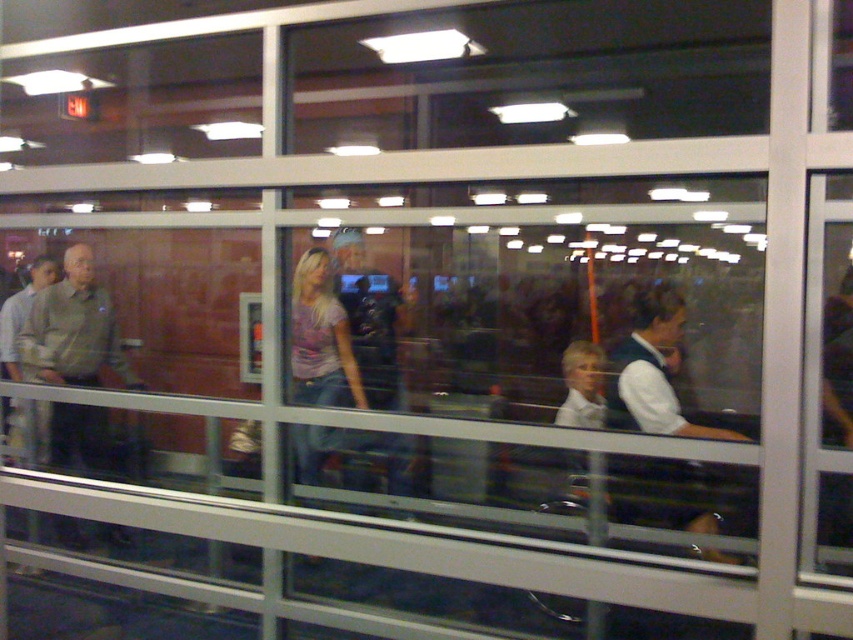
You are standing in front of the glass partition and see the matte gray shirt at left and the matte purple shirt at center. Which person is closer to the glass partition?

The matte gray shirt at left is closer to the glass partition because it is positioned under the matte purple shirt at center, indicating it is in a lower position relative to the observer.

You are standing in front of a glass partition with a matte gray shirt at left and a white shirt at center. Which shirt is closer to you?

The matte gray shirt at left is closer to you because it is further to the viewer than the white shirt at center.

You are standing in front of the glass partition and see two points marked on the glass. One is at point (44, 369) and the other is at point (293, 355). Which point is closer to you?

Point (293, 355) is closer to you because it is less further to the camera than point (44, 369).